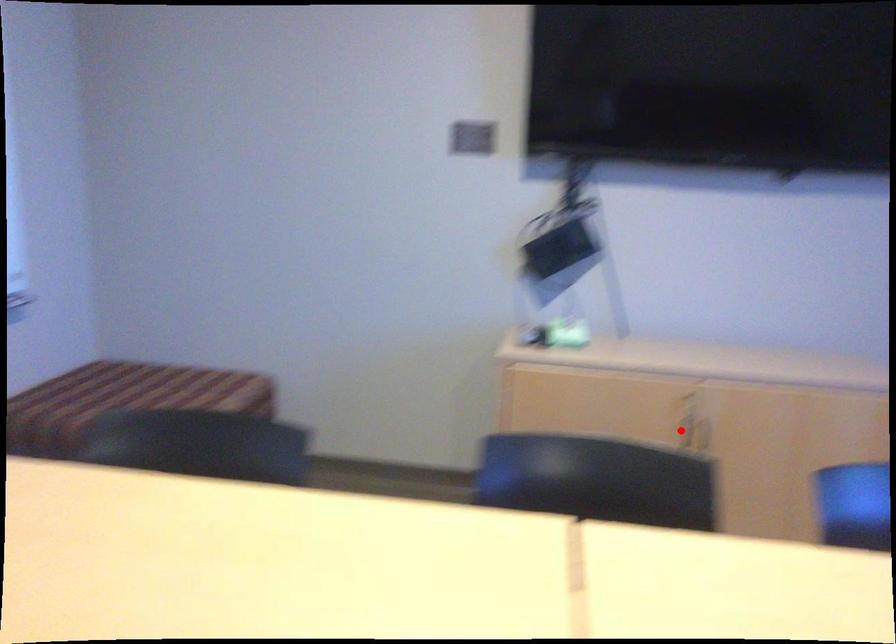
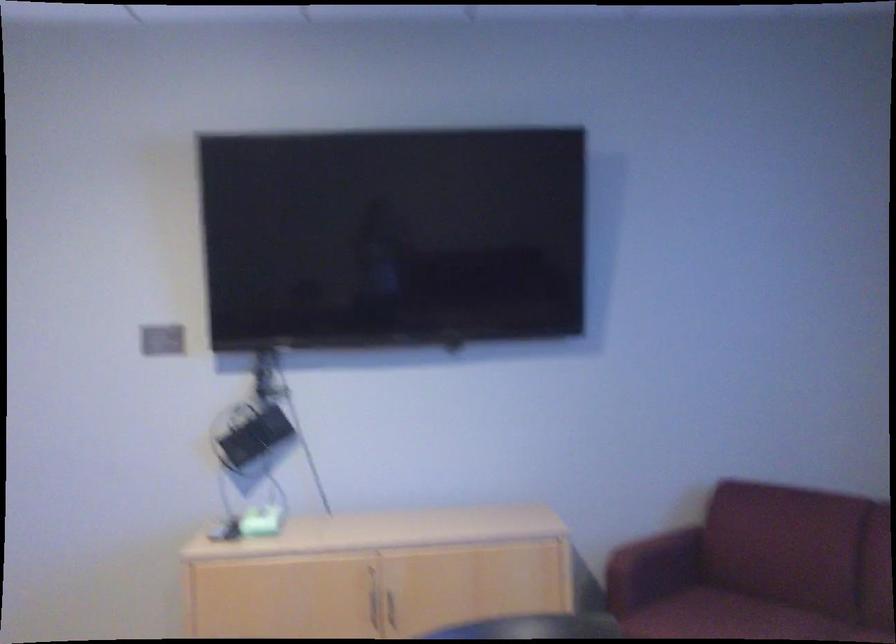
Find the pixel in the second image that matches the highlighted location in the first image.

(374, 607)